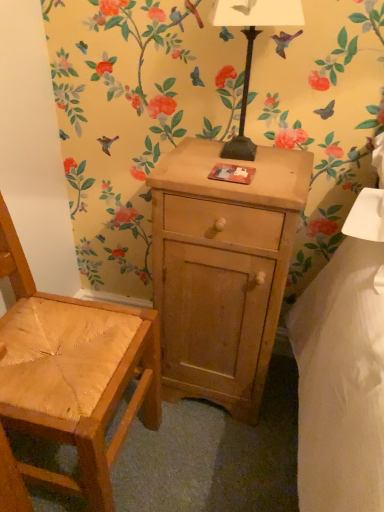
Find the location of a particular element. natural wood chair at left is located at coordinates (73, 372).

The image size is (384, 512). I want to click on metallic black lamp at upper center, so click(252, 49).

From a real-world perspective, which object rests below the other?

From a 3D spatial view, light brown wood cabinet at center is below.

How different are the orientations of metallic black lamp at upper center and light brown wood cabinet at center in degrees?

3.87 degrees separate the facing orientations of metallic black lamp at upper center and light brown wood cabinet at center.

The image size is (384, 512). I want to click on desk behind the metallic black lamp at upper center, so [x=222, y=269].

Between metallic black lamp at upper center and light brown wood cabinet at center, which one appears on the left side from the viewer's perspective?

light brown wood cabinet at center is more to the left.

At what (x,y) coordinates should I click in order to perform the action: click on chair located underneath the metallic black lamp at upper center (from a real-world perspective). Please return your answer as a coordinate pair (x, y). Looking at the image, I should click on (73, 372).

Which is more to the left, metallic black lamp at upper center or natural wood chair at left?

Positioned to the left is natural wood chair at left.

From the image's perspective, would you say metallic black lamp at upper center is positioned over natural wood chair at left?

Yes, from the image's perspective, metallic black lamp at upper center is above natural wood chair at left.

From the image's perspective, is light brown wood cabinet at center over natural wood chair at left?

Yes, from the image's perspective, light brown wood cabinet at center is on top of natural wood chair at left.

Does light brown wood cabinet at center turn towards natural wood chair at left?

No, light brown wood cabinet at center is not facing towards natural wood chair at left.

From a real-world perspective, between light brown wood cabinet at center and natural wood chair at left, who is vertically lower?

In real-world perspective, light brown wood cabinet at center is lower.

From the picture: Is light brown wood cabinet at center beside metallic black lamp at upper center?

light brown wood cabinet at center and metallic black lamp at upper center are clearly separated.

Image resolution: width=384 pixels, height=512 pixels. In the image, there is a light brown wood cabinet at center. What are the coordinates of `lamp above it (from the image's perspective)` in the screenshot? It's located at (252, 49).

What's the angular difference between light brown wood cabinet at center and metallic black lamp at upper center's facing directions?

The facing directions of light brown wood cabinet at center and metallic black lamp at upper center are 3.87 degrees apart.

From the image's perspective, is light brown wood cabinet at center located above metallic black lamp at upper center?

No, from the image's perspective, light brown wood cabinet at center is not above metallic black lamp at upper center.

Measure the distance from natural wood chair at left to metallic black lamp at upper center.

The distance of natural wood chair at left from metallic black lamp at upper center is 25.32 inches.

Which is behind, natural wood chair at left or metallic black lamp at upper center?

Positioned behind is metallic black lamp at upper center.

Is natural wood chair at left situated inside metallic black lamp at upper center or outside?

The correct answer is: outside.

How many degrees apart are the facing directions of natural wood chair at left and light brown wood cabinet at center?

The facing directions of natural wood chair at left and light brown wood cabinet at center are 89.6 degrees apart.

You are a GUI agent. You are given a task and a screenshot of the screen. Output one action in this format:
    pyautogui.click(x=<x>, y=<y>)
    Task: Click on the chair on the left of light brown wood cabinet at center
    The height and width of the screenshot is (512, 384).
    Given the screenshot: What is the action you would take?
    pyautogui.click(x=73, y=372)

From a real-world perspective, which object rests below the other?

From a 3D spatial view, light brown wood cabinet at center is below.

Based on the photo, is natural wood chair at left not inside light brown wood cabinet at center?

Absolutely, natural wood chair at left is external to light brown wood cabinet at center.

Identify the location of desk that appears below the metallic black lamp at upper center (from a real-world perspective). (222, 269).

Identify the location of chair in front of the metallic black lamp at upper center. (73, 372).

Considering their positions, is light brown wood cabinet at center positioned further to natural wood chair at left than metallic black lamp at upper center?

metallic black lamp at upper center.

Which object lies further to the anchor point metallic black lamp at upper center, light brown wood cabinet at center or natural wood chair at left?

Among the two, natural wood chair at left is located further to metallic black lamp at upper center.

When comparing their distances from light brown wood cabinet at center, does metallic black lamp at upper center or natural wood chair at left seem closer?

The object closer to light brown wood cabinet at center is natural wood chair at left.

Based on their spatial positions, is metallic black lamp at upper center or light brown wood cabinet at center closer to natural wood chair at left?

Based on the image, light brown wood cabinet at center appears to be nearer to natural wood chair at left.

Looking at the image, which one is located closer to metallic black lamp at upper center, natural wood chair at left or light brown wood cabinet at center?

light brown wood cabinet at center is positioned closer to the anchor metallic black lamp at upper center.

When comparing their distances from light brown wood cabinet at center, does natural wood chair at left or metallic black lamp at upper center seem closer?

natural wood chair at left.

Identify the location of desk that lies between metallic black lamp at upper center and natural wood chair at left from top to bottom. This screenshot has width=384, height=512. (222, 269).